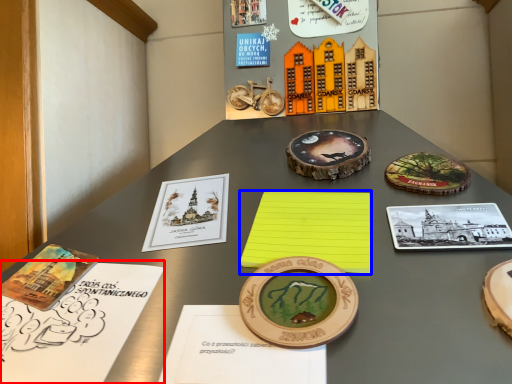
Question: Which of the following is the closest to the observer, notebook (highlighted by a red box) or notebook (highlighted by a blue box)?

Choices:
 (A) notebook
 (B) notebook

Answer: (A)